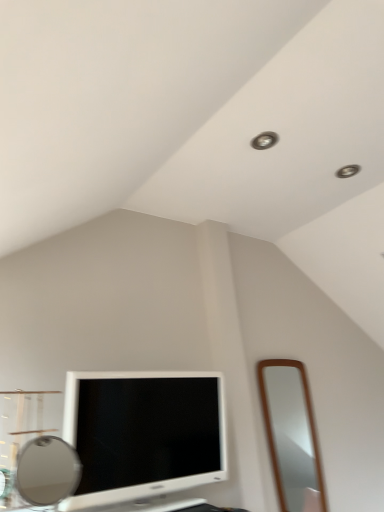
Question: From the image's perspective, is matte silver mirror at lower left, which is counted as the first mirror, starting from the front, over white glossy television at lower left?

Choices:
 (A) yes
 (B) no

Answer: (A)

Question: Considering the relative sizes of matte silver mirror at lower left, which ranks as the second mirror in right-to-left order, and white glossy television at lower left in the image provided, is matte silver mirror at lower left, which ranks as the second mirror in right-to-left order, thinner than white glossy television at lower left?

Choices:
 (A) no
 (B) yes

Answer: (B)

Question: Does matte silver mirror at lower left, which ranks as the second mirror in right-to-left order, have a lesser height compared to white glossy television at lower left?

Choices:
 (A) yes
 (B) no

Answer: (A)

Question: Is matte silver mirror at lower left, which ranks as the second mirror in right-to-left order, with white glossy television at lower left?

Choices:
 (A) no
 (B) yes

Answer: (A)

Question: Is matte silver mirror at lower left, the first mirror when ordered from left to right, not inside white glossy television at lower left?

Choices:
 (A) yes
 (B) no

Answer: (A)

Question: Does matte silver mirror at lower left, the second mirror in the back-to-front sequence, have a smaller size compared to white glossy television at lower left?

Choices:
 (A) no
 (B) yes

Answer: (B)

Question: Is white glossy television at lower left bigger than matte silver mirror at lower left, the first mirror when ordered from left to right?

Choices:
 (A) yes
 (B) no

Answer: (A)

Question: Could you tell me if white glossy television at lower left is turned towards matte silver mirror at lower left, the first mirror when ordered from left to right?

Choices:
 (A) yes
 (B) no

Answer: (B)

Question: From a real-world perspective, is white glossy television at lower left physically above matte silver mirror at lower left, the first mirror when ordered from left to right?

Choices:
 (A) yes
 (B) no

Answer: (A)

Question: Is white glossy television at lower left not near matte silver mirror at lower left, the first mirror when ordered from left to right?

Choices:
 (A) yes
 (B) no

Answer: (B)

Question: Can matte silver mirror at lower left, the second mirror in the back-to-front sequence, be found inside white glossy television at lower left?

Choices:
 (A) no
 (B) yes

Answer: (A)

Question: Considering the relative sizes of white glossy television at lower left and matte silver mirror at lower left, which is counted as the first mirror, starting from the front, in the image provided, is white glossy television at lower left wider than matte silver mirror at lower left, which is counted as the first mirror, starting from the front,?

Choices:
 (A) yes
 (B) no

Answer: (A)

Question: Can you confirm if white glossy television at lower left is shorter than brown wooden mirror at right, acting as the first mirror starting from the back?

Choices:
 (A) yes
 (B) no

Answer: (A)